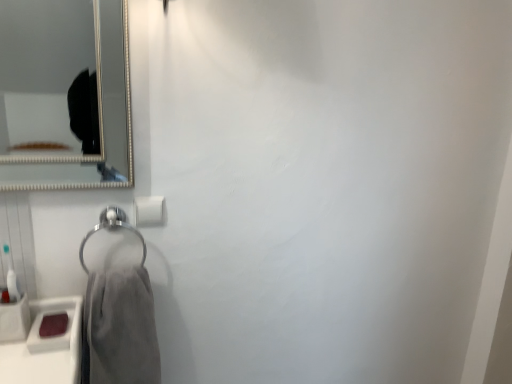
Question: Considering the relative sizes of matte pink soap at lower left and gray cotton towel at lower left in the image provided, is matte pink soap at lower left wider than gray cotton towel at lower left?

Choices:
 (A) yes
 (B) no

Answer: (B)

Question: Can you confirm if matte pink soap at lower left is thinner than gray cotton towel at lower left?

Choices:
 (A) yes
 (B) no

Answer: (A)

Question: Can you confirm if matte pink soap at lower left is positioned to the right of gray cotton towel at lower left?

Choices:
 (A) yes
 (B) no

Answer: (B)

Question: Is matte pink soap at lower left turned away from gray cotton towel at lower left?

Choices:
 (A) yes
 (B) no

Answer: (B)

Question: From the image's perspective, is matte pink soap at lower left on top of gray cotton towel at lower left?

Choices:
 (A) yes
 (B) no

Answer: (A)

Question: Is matte pink soap at lower left located outside gray cotton towel at lower left?

Choices:
 (A) yes
 (B) no

Answer: (A)

Question: Is matte pink soap at lower left inside white matte toilet paper at center?

Choices:
 (A) yes
 (B) no

Answer: (B)

Question: Is white matte toilet paper at center behind matte pink soap at lower left?

Choices:
 (A) yes
 (B) no

Answer: (A)

Question: Can you confirm if white matte toilet paper at center is taller than matte pink soap at lower left?

Choices:
 (A) no
 (B) yes

Answer: (B)

Question: Is white matte toilet paper at center smaller than matte pink soap at lower left?

Choices:
 (A) yes
 (B) no

Answer: (A)

Question: From the image's perspective, is white matte toilet paper at center under matte pink soap at lower left?

Choices:
 (A) yes
 (B) no

Answer: (B)

Question: From a real-world perspective, is white matte toilet paper at center located higher than matte pink soap at lower left?

Choices:
 (A) no
 (B) yes

Answer: (B)

Question: Is gray cotton towel at lower left smaller than matte pink soap at lower left?

Choices:
 (A) no
 (B) yes

Answer: (A)